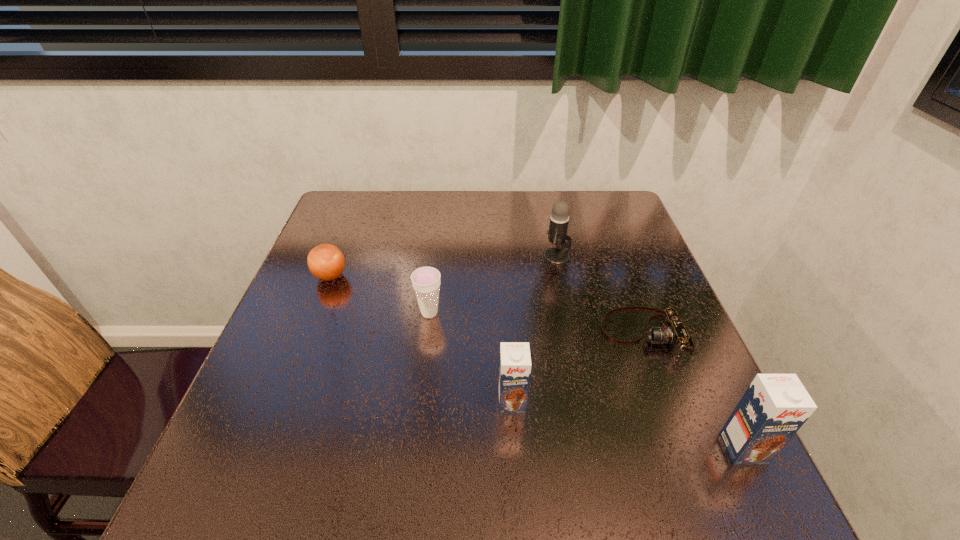
Locate an element on the screen. This screenshot has width=960, height=540. the fifth farthest object is located at coordinates [x=515, y=361].

Locate an element on the screen. The height and width of the screenshot is (540, 960). the farther chocolate milk is located at coordinates (515, 361).

This screenshot has height=540, width=960. I want to click on the taller chocolate milk, so click(774, 407).

Where is `the right chocolate milk`? the right chocolate milk is located at coordinates (774, 407).

This screenshot has height=540, width=960. Identify the location of the third object from right to left. (557, 234).

Where is `the shortest object`? the shortest object is located at coordinates (672, 331).

Locate an element on the screen. the fifth object from right to left is located at coordinates (426, 280).

The image size is (960, 540). In order to click on the fourth tallest object in this screenshot , I will do `click(426, 280)`.

The height and width of the screenshot is (540, 960). Find the location of `the fifth tallest object`. the fifth tallest object is located at coordinates (326, 262).

Find the location of a particular element. Image resolution: width=960 pixels, height=540 pixels. the leftmost object is located at coordinates (326, 262).